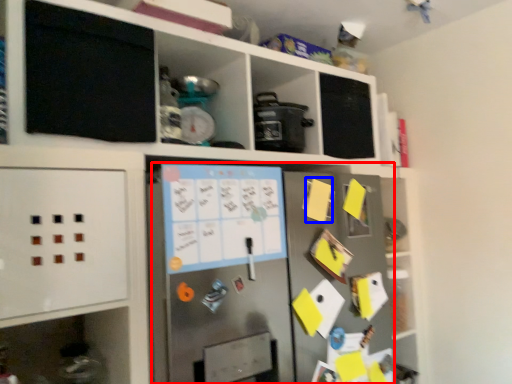
Question: Among these objects, which one is farthest to the camera, fridge (highlighted by a red box) or note (highlighted by a blue box)?

Choices:
 (A) fridge
 (B) note

Answer: (B)